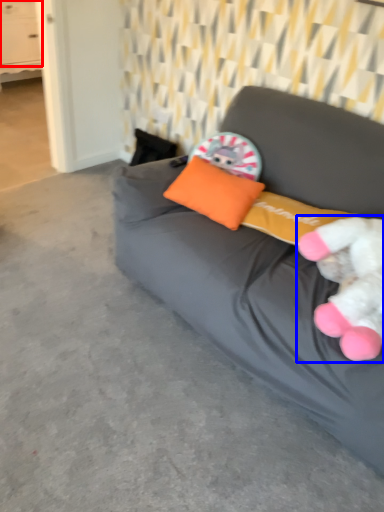
Question: Which of the following is the closest to the observer, drawer (highlighted by a red box) or toy (highlighted by a blue box)?

Choices:
 (A) drawer
 (B) toy

Answer: (B)